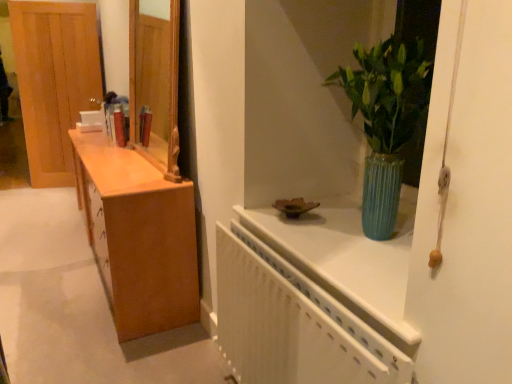
Question: From a real-world perspective, is white textured radiator at upper right positioned above or below light brown wood door at left?

Choices:
 (A) above
 (B) below

Answer: (B)

Question: In the image, is white textured radiator at upper right positioned in front of or behind light brown wood door at left?

Choices:
 (A) front
 (B) behind

Answer: (A)

Question: Which is farther from the white textured radiator at upper right?

Choices:
 (A) green ribbed vase at upper right
 (B) light brown wood door at left

Answer: (B)

Question: Based on their relative distances, which object is nearer to the green ribbed vase at upper right?

Choices:
 (A) light brown wood door at left
 (B) white textured radiator at upper right

Answer: (B)